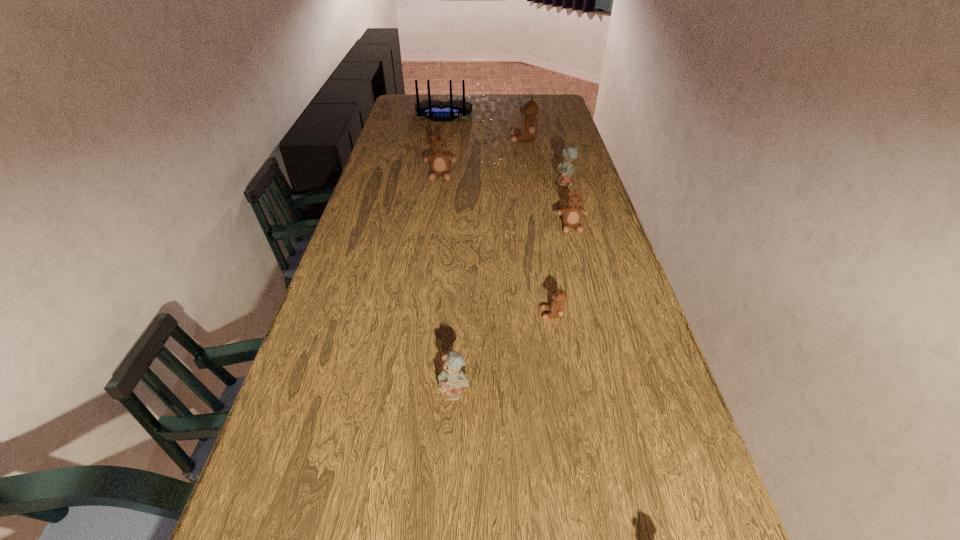
At what (x,y) coordinates should I click in order to perform the action: click on the nearest teddy bear. Please return your answer as a coordinate pair (x, y). Looking at the image, I should click on (452, 381).

At what (x,y) coordinates should I click in order to perform the action: click on the nearer blue teddy bear. Please return your answer as a coordinate pair (x, y). This screenshot has width=960, height=540. Looking at the image, I should click on (452, 381).

Locate an element on the screen. The height and width of the screenshot is (540, 960). the smallest brown teddy bear is located at coordinates (557, 308).

Locate an element on the screen. The width and height of the screenshot is (960, 540). the nearest brown teddy bear is located at coordinates (557, 308).

This screenshot has width=960, height=540. Find the location of `vacant space situated on the back of the router`. vacant space situated on the back of the router is located at coordinates 441,130.

In order to click on vacant space situated 0.230m on the front-facing side of the farthest teddy bear in this screenshot , I will do click(457, 139).

Find the location of `vacant position located 0.270m on the front-facing side of the farthest teddy bear`. vacant position located 0.270m on the front-facing side of the farthest teddy bear is located at coordinates (447, 139).

Identify the location of free spot located on the front-facing side of the farthest teddy bear. This screenshot has width=960, height=540. (464, 139).

Image resolution: width=960 pixels, height=540 pixels. Identify the location of vacant space situated on the front-facing side of the right blue teddy bear. (491, 184).

Locate an element on the screen. Image resolution: width=960 pixels, height=540 pixels. vacant region located 0.060m on the front-facing side of the right blue teddy bear is located at coordinates tap(540, 184).